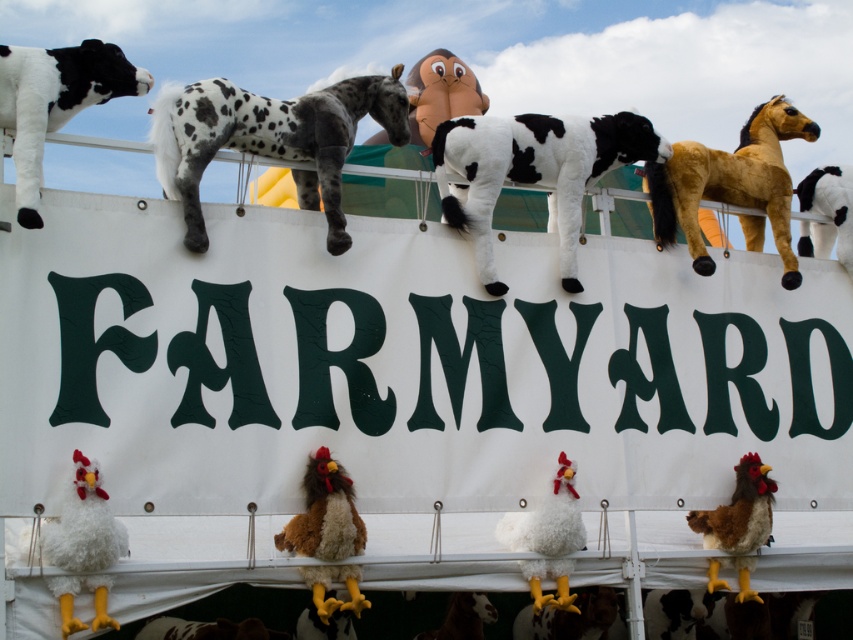
This screenshot has height=640, width=853. In order to click on soft plush cow at center in this screenshot , I will do `click(532, 172)`.

Which of these two, soft plush cow at center or brown fuzzy chicken at lower right, stands taller?

With more height is soft plush cow at center.

Describe the element at coordinates (532, 172) in the screenshot. I see `soft plush cow at center` at that location.

At what (x,y) coordinates should I click in order to perform the action: click on soft plush cow at center. Please return your answer as a coordinate pair (x, y). Looking at the image, I should click on (532, 172).

What do you see at coordinates (532, 172) in the screenshot? The height and width of the screenshot is (640, 853). I see `soft plush cow at center` at bounding box center [532, 172].

Which is more to the right, soft plush cow at center or black and white plush cow at upper left?

soft plush cow at center

What do you see at coordinates (532, 172) in the screenshot? I see `soft plush cow at center` at bounding box center [532, 172].

Identify the location of soft plush cow at center. (532, 172).

Can you confirm if soft plush cow at center is shorter than white fluffy chicken at lower center?

In fact, soft plush cow at center may be taller than white fluffy chicken at lower center.

Between soft plush cow at center and white fluffy chicken at lower center, which one is positioned higher?

soft plush cow at center

Find the location of a particular element. The image size is (853, 640). soft plush cow at center is located at coordinates (532, 172).

The image size is (853, 640). I want to click on soft plush cow at center, so click(x=532, y=172).